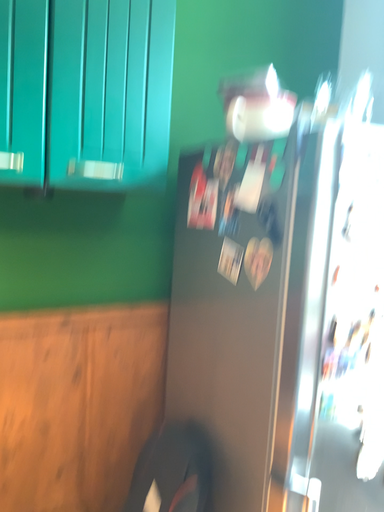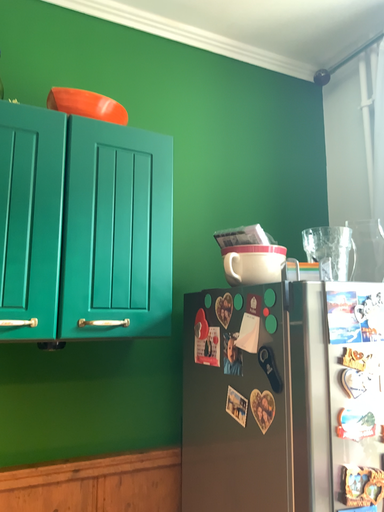
Question: Which way did the camera rotate in the video?

Choices:
 (A) rotated upward
 (B) rotated downward

Answer: (A)